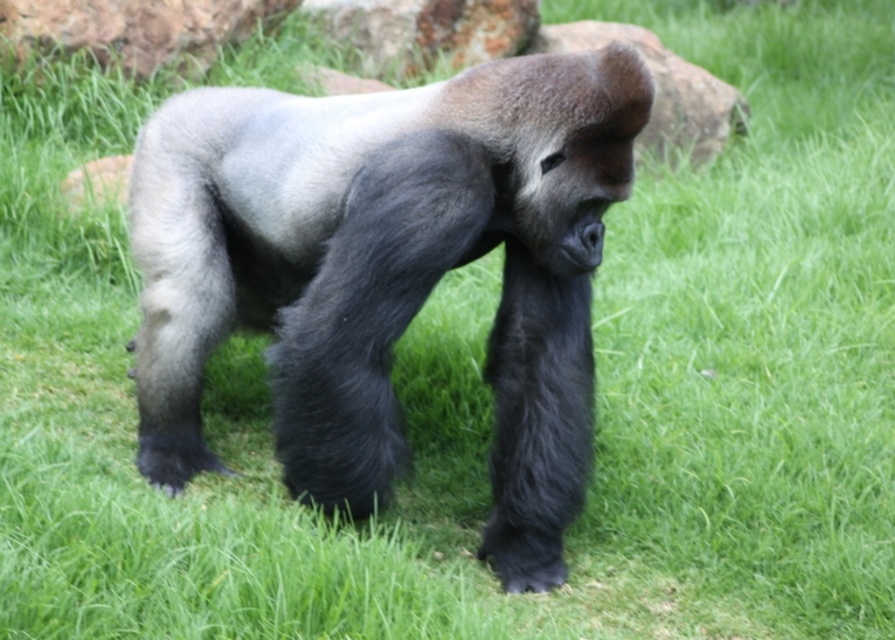
Question: Does fuzzy gray gorilla at center appear over brown rough rock at upper center?

Choices:
 (A) yes
 (B) no

Answer: (B)

Question: Estimate the real-world distances between objects in this image. Which object is farther from the rusty metal rock at upper center?

Choices:
 (A) brown rough rock at upper center
 (B) brown rock at upper left
 (C) fuzzy gray gorilla at center

Answer: (C)

Question: Among these objects, which one is farthest from the camera?

Choices:
 (A) green grass at lower left
 (B) brown rock at upper left
 (C) brown rough rock at upper center
 (D) rusty metal rock at upper center

Answer: (D)

Question: Observing the image, what is the correct spatial positioning of brown rock at upper left in reference to green grass at lower left?

Choices:
 (A) below
 (B) above

Answer: (B)

Question: From the image, what is the correct spatial relationship of fuzzy gray gorilla at center in relation to rusty metal rock at upper center?

Choices:
 (A) below
 (B) above

Answer: (A)

Question: Which object is positioned farthest from the rusty metal rock at upper center?

Choices:
 (A) green grass at lower left
 (B) brown rock at upper left
 (C) fuzzy gray gorilla at center
 (D) brown rough rock at upper center

Answer: (C)